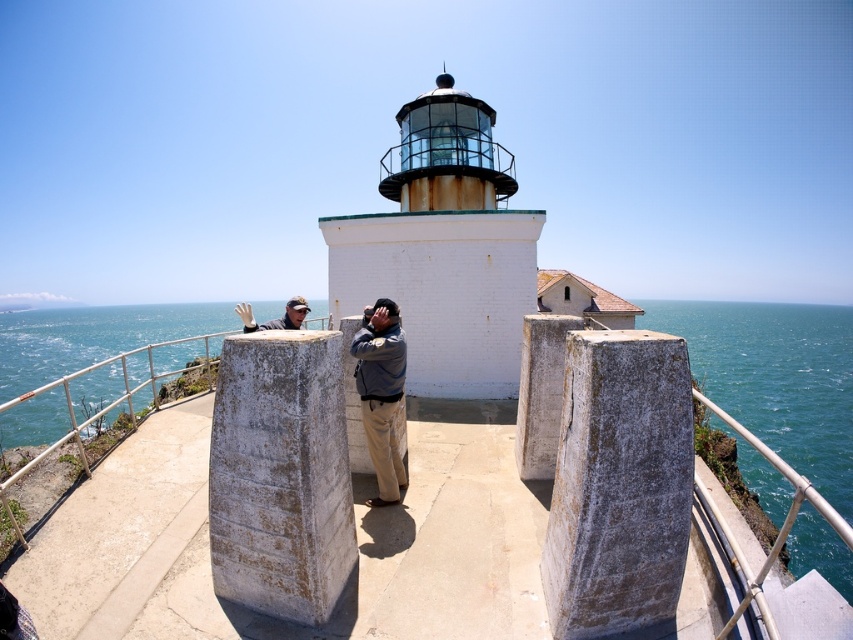
Question: Does blue water at center have a lesser width compared to blue water at lower right?

Choices:
 (A) yes
 (B) no

Answer: (B)

Question: Based on their relative distances, which object is nearer to the blue water at center?

Choices:
 (A) matte gray jacket at center
 (B) blue water at lower right

Answer: (B)

Question: Can you confirm if blue water at lower right is positioned above denim jacket at center?

Choices:
 (A) no
 (B) yes

Answer: (B)

Question: Which object is farther from the camera taking this photo?

Choices:
 (A) matte gray jacket at center
 (B) white brick lighthouse at center

Answer: (B)

Question: Can you confirm if denim jacket at center is thinner than matte gray jacket at center?

Choices:
 (A) no
 (B) yes

Answer: (B)

Question: Which of the following is the closest to the observer?

Choices:
 (A) blue water at lower right
 (B) white brick lighthouse at center
 (C) blue water at center
 (D) matte gray jacket at center

Answer: (A)